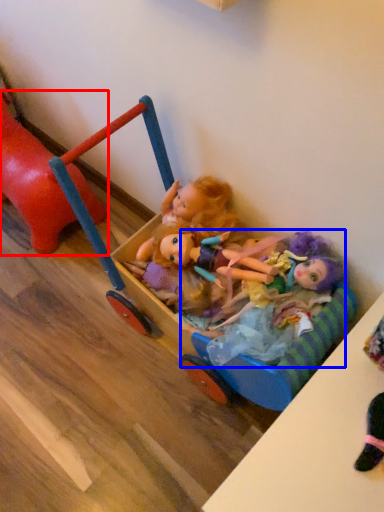
Question: Which object is further to the camera taking this photo, toy (highlighted by a red box) or doll (highlighted by a blue box)?

Choices:
 (A) toy
 (B) doll

Answer: (A)